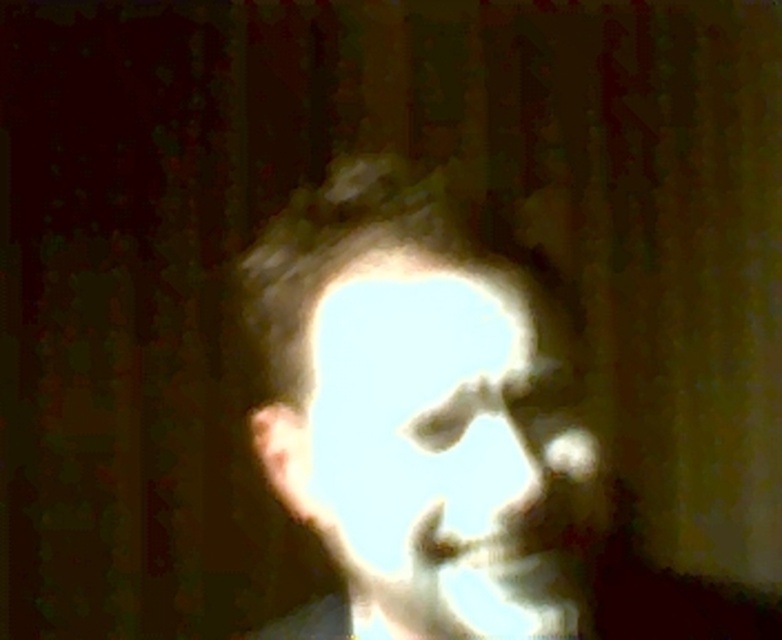
Looking at this image, you are a photographer reviewing a photo of a person with two faces in the center. The scene has a light gray matte face at center and a translucent white face at center. Which face is positioned to the right side?

The light gray matte face at center is positioned to the right of the translucent white face at center.

You are a photographer trying to capture a clear portrait. You notice two faces in the frame, the light gray matte face at center and the translucent white face at center. Which face is closer to the camera?

The light gray matte face at center is closer to the camera because it is further to the viewer than the translucent white face at center.

Based on the scene description, can you determine if the light gray matte face at center is wider than the translucent white face at center?

The light gray matte face at center might be wider than translucent white face at center according to the description.